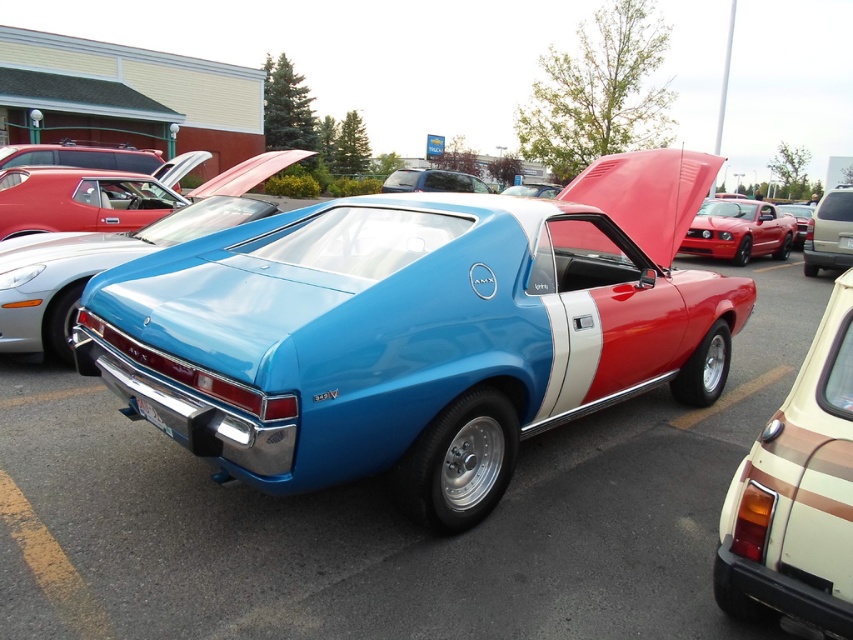
You are a photographer planning to take a photo of the glossy metallic car at center and the shiny red car at upper left. Since you want both cars to appear equally sized in the final image, which car should you move closer to, and which should you move farther away?

To make both cars appear the same size in the photo, move closer to the glossy metallic car at center and move farther away from the shiny red car at upper left. This adjustment compensates for their actual size difference, as the glossy metallic car at center is smaller than the shiny red car at upper left.

You are standing at the origin point of the coordinate system. Where is the glossy metallic car at center located?

The glossy metallic car at center is located at point (384,520).